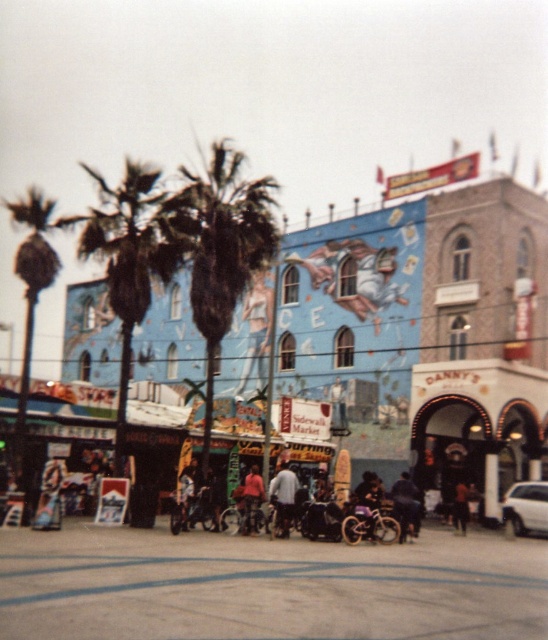
Question: Can you confirm if white matte car at lower right is wider than matte pink shirt at center?

Choices:
 (A) yes
 (B) no

Answer: (A)

Question: Which of the following is the farthest from the observer?

Choices:
 (A) (36, 195)
 (B) (278, 529)

Answer: (A)

Question: Does white matte car at lower right appear on the left side of white cotton shirt at center?

Choices:
 (A) no
 (B) yes

Answer: (A)

Question: Which object is positioned closest to the white matte car at lower right?

Choices:
 (A) black plastic baby carriage at center
 (B) dark blue jeans at center

Answer: (B)

Question: Can you confirm if green leafy palm tree at center is positioned to the left of white matte car at lower right?

Choices:
 (A) yes
 (B) no

Answer: (A)

Question: Which point is closer to the camera taking this photo?

Choices:
 (A) (409, 490)
 (B) (246, 259)
 (C) (545, 500)

Answer: (A)